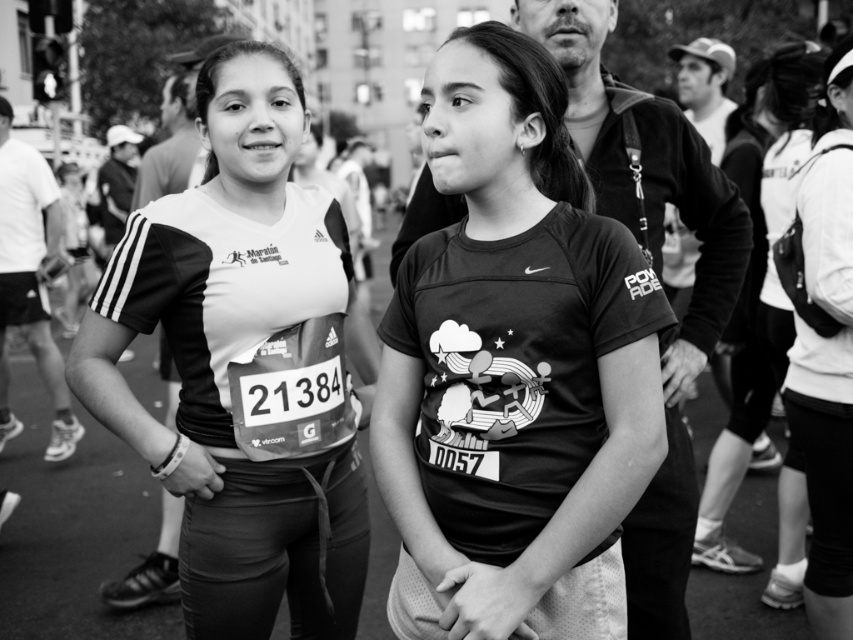
Question: Does matte black shirt at center have a smaller size compared to white fabric backpack at right?

Choices:
 (A) no
 (B) yes

Answer: (A)

Question: Among these objects, which one is nearest to the camera?

Choices:
 (A) white cotton hoodie at right
 (B) matte black shirt at center

Answer: (B)

Question: Which of the following is the farthest from the observer?

Choices:
 (A) white fabric backpack at right
 (B) matte black shirt at center

Answer: (A)

Question: Which object is closer to the camera taking this photo?

Choices:
 (A) white cotton hoodie at right
 (B) matte black t-shirt at center

Answer: (B)

Question: Is matte black shirt at center in front of white fabric backpack at right?

Choices:
 (A) no
 (B) yes

Answer: (B)

Question: Considering the relative positions of matte black t-shirt at center and white cotton hoodie at right in the image provided, where is matte black t-shirt at center located with respect to white cotton hoodie at right?

Choices:
 (A) right
 (B) left

Answer: (B)